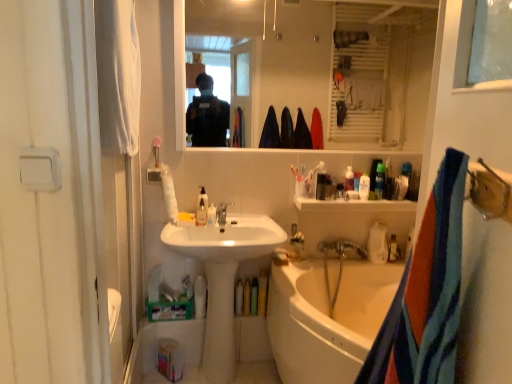
Question: From the image's perspective, is white plastic bottle at upper center, which is the fourth toiletry from left to right, on white plastic shelf at upper center?

Choices:
 (A) no
 (B) yes

Answer: (B)

Question: Is white plastic bottle at upper center, which is the fourth toiletry from left to right, taller than white plastic shelf at upper center?

Choices:
 (A) yes
 (B) no

Answer: (A)

Question: Does white plastic bottle at upper center, arranged as the 2th toiletry when viewed from the right, lie in front of white plastic shelf at upper center?

Choices:
 (A) no
 (B) yes

Answer: (A)

Question: Is white plastic bottle at upper center, arranged as the 2th toiletry when viewed from the right, facing away from white plastic shelf at upper center?

Choices:
 (A) yes
 (B) no

Answer: (B)

Question: Is the position of white plastic bottle at upper center, arranged as the 2th toiletry when viewed from the right, more distant than that of white plastic shelf at upper center?

Choices:
 (A) yes
 (B) no

Answer: (A)

Question: Considering the positions of blue striped towel at right, which is counted as the second towel/napkin, starting from the top, and translucent plastic soap dispenser at center, the 1th toiletry when ordered from left to right, in the image, is blue striped towel at right, which is counted as the second towel/napkin, starting from the top, taller or shorter than translucent plastic soap dispenser at center, the 1th toiletry when ordered from left to right,?

Choices:
 (A) tall
 (B) short

Answer: (A)

Question: From the image's perspective, is blue striped towel at right, which appears as the 2th towel/napkin when viewed from the left, positioned above or below translucent plastic soap dispenser at center, which is the 5th toiletry from right to left?

Choices:
 (A) below
 (B) above

Answer: (A)

Question: In the image, is blue striped towel at right, which appears as the 2th towel/napkin when viewed from the left, on the left side or the right side of translucent plastic soap dispenser at center, the 1th toiletry when ordered from left to right?

Choices:
 (A) right
 (B) left

Answer: (A)

Question: Relative to translucent plastic soap dispenser at center, which is the 5th toiletry from right to left, is blue striped towel at right, which appears as the 2th towel/napkin when viewed from the left, in front or behind?

Choices:
 (A) front
 (B) behind

Answer: (A)

Question: Is point (300, 9) positioned closer to the camera than point (227, 344)?

Choices:
 (A) closer
 (B) farther

Answer: (B)

Question: Is clear glass mirror at upper center spatially inside white glossy sink at center, or outside of it?

Choices:
 (A) inside
 (B) outside

Answer: (B)

Question: Looking at their shapes, would you say clear glass mirror at upper center is wider or thinner than white glossy sink at center?

Choices:
 (A) thin
 (B) wide

Answer: (A)

Question: From the image's perspective, is clear glass mirror at upper center located above or below white glossy sink at center?

Choices:
 (A) below
 (B) above

Answer: (B)

Question: Considering the positions of point (311, 36) and point (212, 216), is point (311, 36) closer or farther from the camera than point (212, 216)?

Choices:
 (A) closer
 (B) farther

Answer: (B)

Question: From a real-world perspective, is clear glass mirror at upper center above or below translucent plastic soap dispenser at center, which is the 5th toiletry from right to left?

Choices:
 (A) below
 (B) above

Answer: (B)